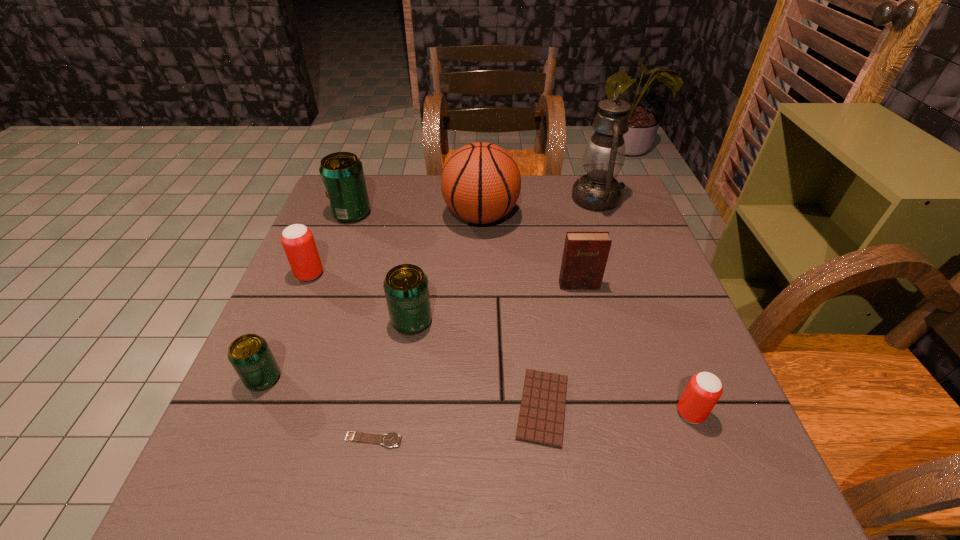
Identify the location of free space located 0.250m on the side where the inflation valve is located. The height and width of the screenshot is (540, 960). (353, 217).

Where is `free spot located on the front of the tallest beer can`? free spot located on the front of the tallest beer can is located at coordinates (325, 283).

Locate an element on the screen. This screenshot has height=540, width=960. free space located on the front cover of the diary is located at coordinates (590, 333).

This screenshot has height=540, width=960. I want to click on free space located on the back of the rightmost green beer can, so click(x=427, y=218).

This screenshot has height=540, width=960. I want to click on free space located 0.130m on the back of the fourth nearest beer can, so click(326, 233).

At what (x,y) coordinates should I click in order to perform the action: click on vacant space located 0.090m on the left of the rightmost beer can. Please return your answer as a coordinate pair (x, y). Image resolution: width=960 pixels, height=540 pixels. Looking at the image, I should click on click(626, 413).

Identify the location of free spot located 0.110m on the right of the fourth farthest beer can. The image size is (960, 540). (338, 379).

Image resolution: width=960 pixels, height=540 pixels. What are the coordinates of `vacant space located 0.150m on the left of the chocolate bar` in the screenshot? It's located at (431, 407).

You are a GUI agent. You are given a task and a screenshot of the screen. Output one action in this format:
    pyautogui.click(x=<x>, y=<y>)
    Task: Click on the vacant space located on the back of the shortest object
    
    Given the screenshot: What is the action you would take?
    pyautogui.click(x=387, y=369)

You are a GUI agent. You are given a task and a screenshot of the screen. Output one action in this format:
    pyautogui.click(x=<x>, y=<y>)
    Task: Click on the oil lamp present at the far edge
    The image size is (960, 540).
    Given the screenshot: What is the action you would take?
    pyautogui.click(x=604, y=156)